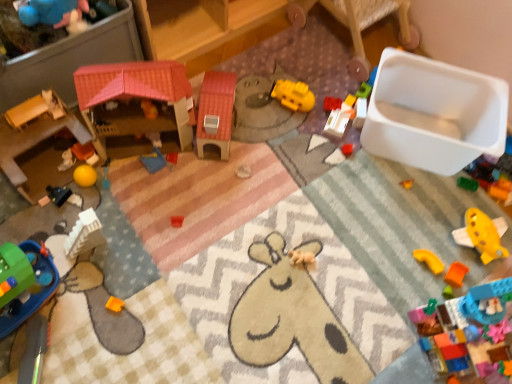
Locate an element on the screen. This screenshot has width=512, height=384. vacant area that lies in front of black plastic toy at lower left, arranged as the 3th toy when viewed from the left is located at coordinates (54, 235).